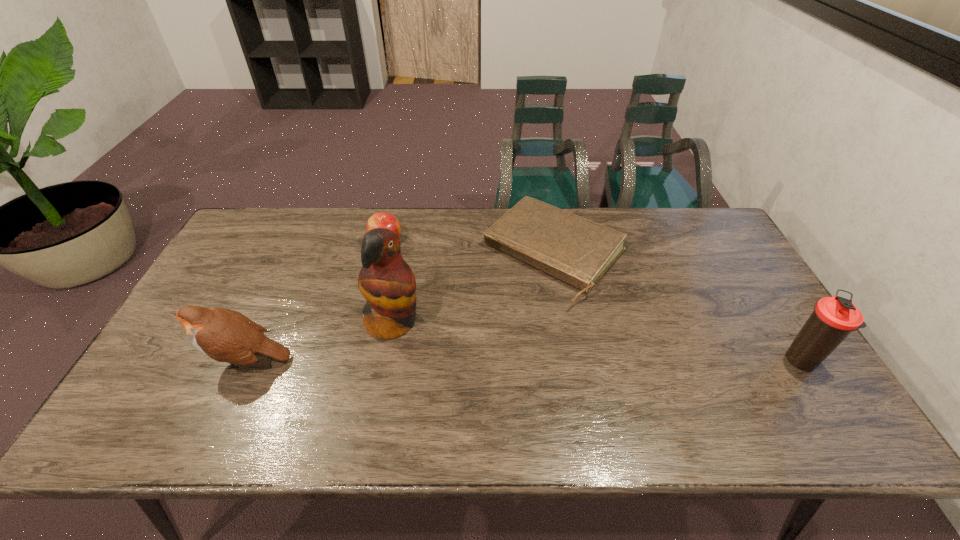
At what (x,y) coordinates should I click in order to perform the action: click on the leftmost object. Please return your answer as a coordinate pair (x, y). The image size is (960, 540). Looking at the image, I should click on (224, 335).

Where is `bird`? Image resolution: width=960 pixels, height=540 pixels. bird is located at coordinates (224, 335).

Where is `the rightmost object`? Image resolution: width=960 pixels, height=540 pixels. the rightmost object is located at coordinates (834, 318).

Where is `the fourth shortest object`? The height and width of the screenshot is (540, 960). the fourth shortest object is located at coordinates (834, 318).

Find the location of a particular element. the tallest object is located at coordinates (386, 281).

Where is `apple`? This screenshot has width=960, height=540. apple is located at coordinates (381, 219).

Where is `the shortest object`? This screenshot has height=540, width=960. the shortest object is located at coordinates (578, 251).

The height and width of the screenshot is (540, 960). Identify the location of paperback book. (578, 251).

I want to click on vacant region located 0.100m at the face of the leftmost object, so click(x=163, y=360).

Where is `vacant position located 0.060m at the face of the leftmost object`? The width and height of the screenshot is (960, 540). vacant position located 0.060m at the face of the leftmost object is located at coordinates (179, 360).